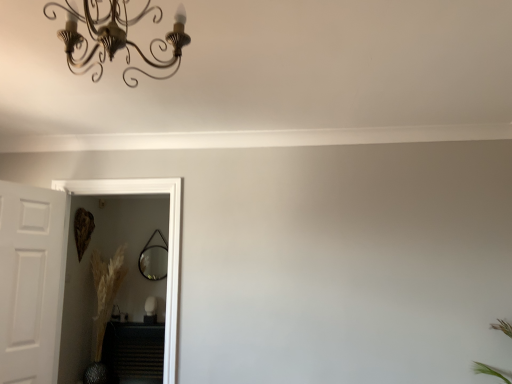
Question: Visually, is silvery metallic vase at lower left positioned to the left or to the right of matte black mirror at center?

Choices:
 (A) right
 (B) left

Answer: (B)

Question: From a real-world perspective, is silvery metallic vase at lower left physically located above or below matte black mirror at center?

Choices:
 (A) below
 (B) above

Answer: (A)

Question: Considering the real-world distances, which object is farthest from the metallic chandelier at upper left?

Choices:
 (A) white matte door at left
 (B) clear glass door at left
 (C) black matte radiator at lower left
 (D) matte black mirror at center
 (E) silvery metallic vase at lower left

Answer: (D)

Question: Considering the real-world distances, which object is farthest from the metallic chandelier at upper left?

Choices:
 (A) white matte door at left
 (B) matte black mirror at center
 (C) clear glass door at left
 (D) black matte radiator at lower left
 (E) silvery metallic vase at lower left

Answer: (B)